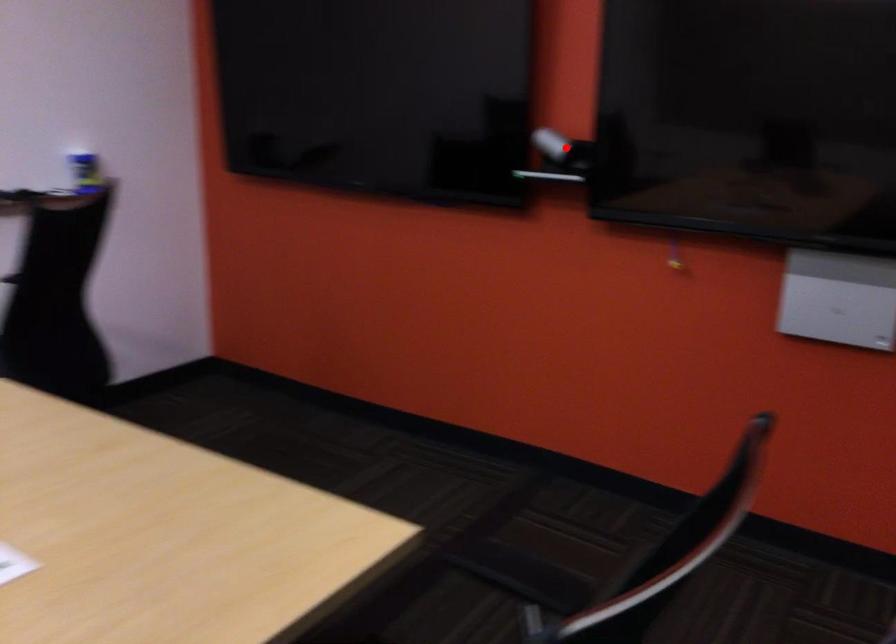
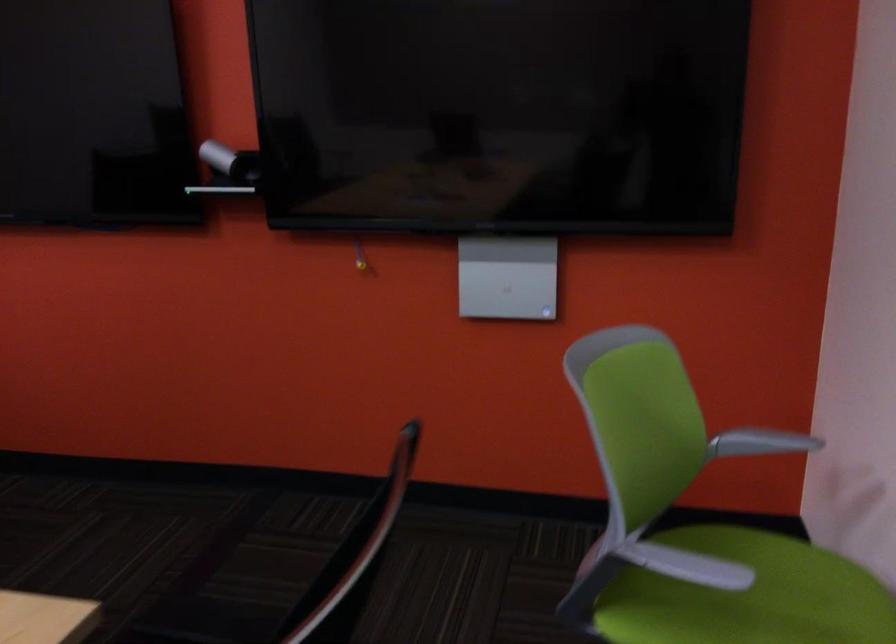
Locate, in the second image, the point that corresponds to the highlighted location in the first image.

(230, 162)